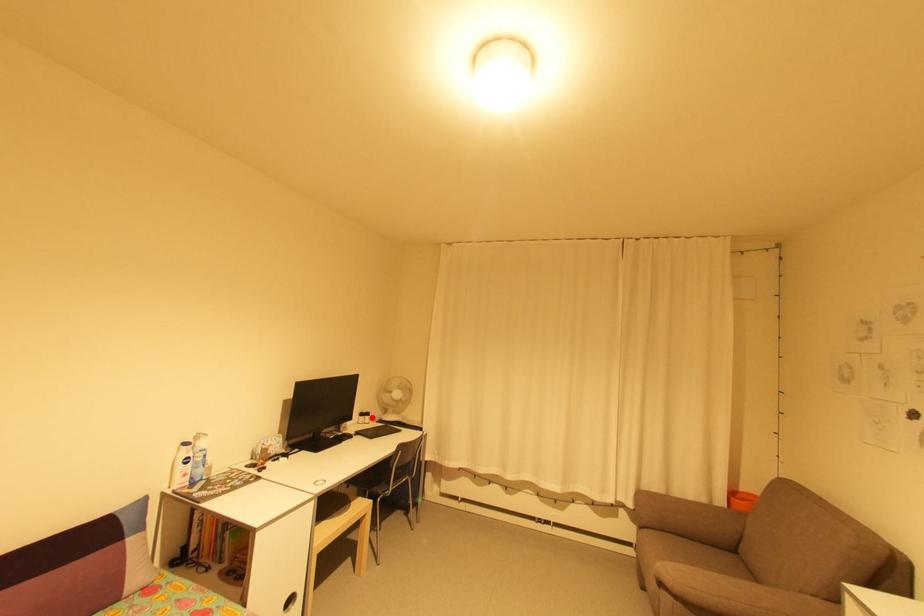
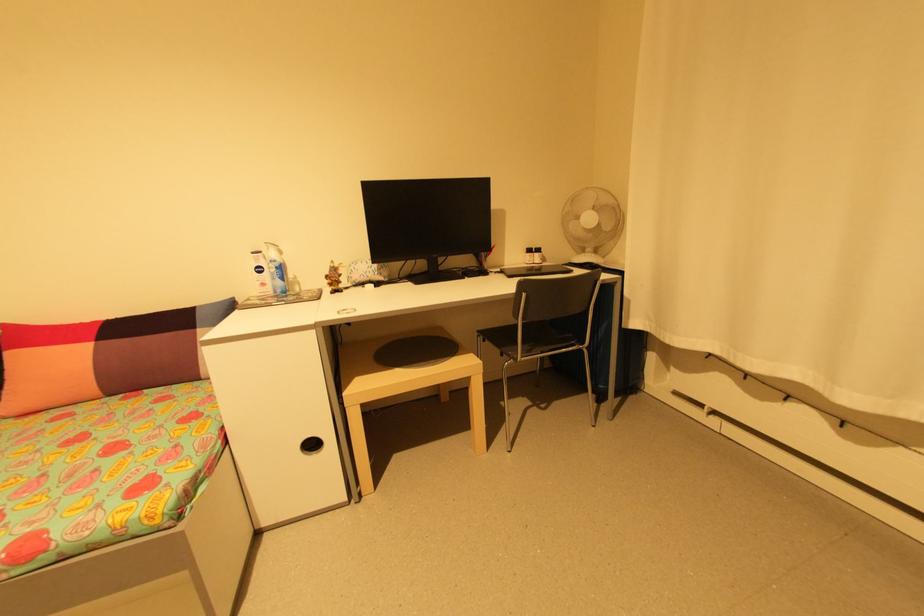
Question: I am providing you with two images of the same scene from different viewpoints. A red point is shown in image1. For the corresponding object point in image2, is it positioned nearer or farther from the camera?

Choices:
 (A) Nearer
 (B) Farther

Answer: (A)